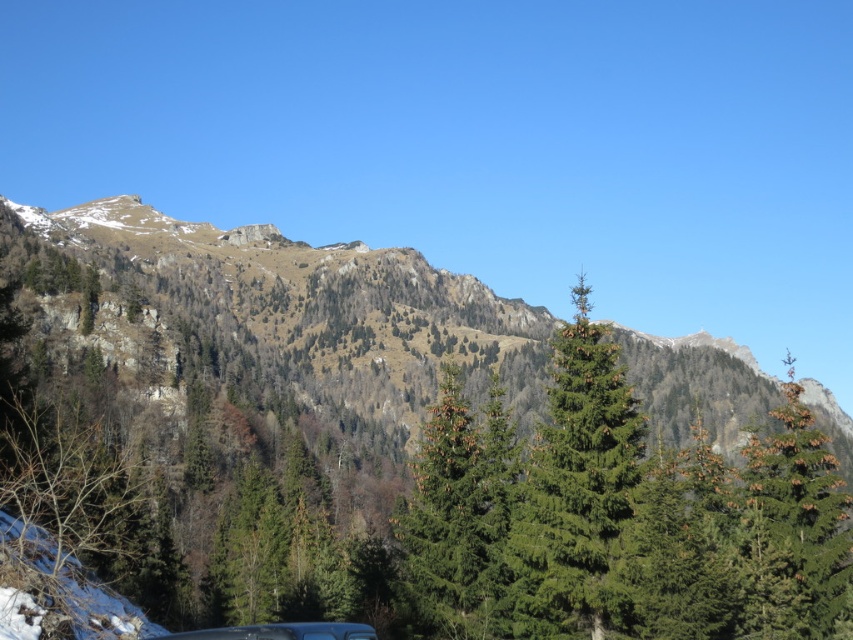
In the scene shown: You are standing at the point marked by point [573,486] in the mountainous landscape. What type of tree are you directly facing?

The point [573,486] marks a green textured pine tree at center, so you are directly facing the green textured pine tree at center.